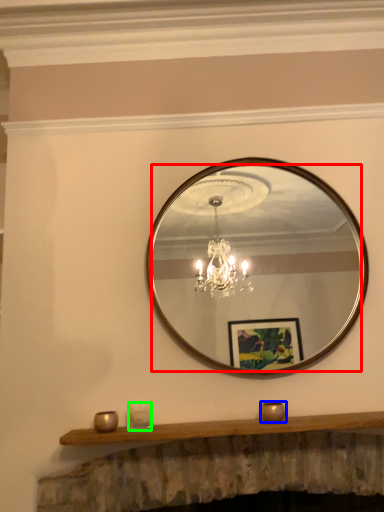
Question: Estimate the real-world distances between objects in this image. Which object is farther from mirror (highlighted by a red box), candle holder (highlighted by a blue box) or candle holder (highlighted by a green box)?

Choices:
 (A) candle holder
 (B) candle holder

Answer: (B)